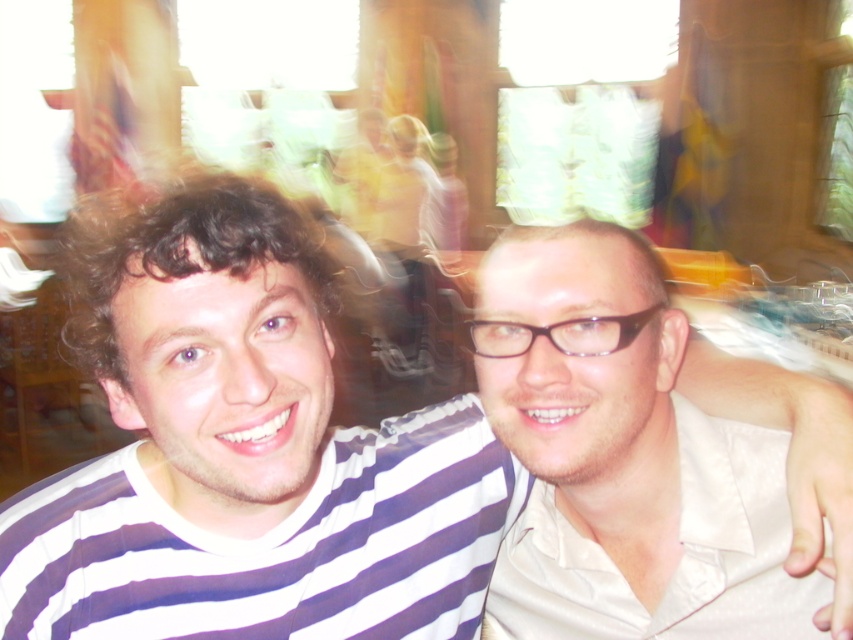
Does white striped shirt at center appear on the left side of matte white shirt at right?

Indeed, white striped shirt at center is positioned on the left side of matte white shirt at right.

Does white striped shirt at center have a smaller size compared to matte white shirt at right?

No, white striped shirt at center is not smaller than matte white shirt at right.

Is point (106, 301) closer to camera compared to point (616, 228)?

Yes, point (106, 301) is in front of point (616, 228).

Identify the location of white striped shirt at center. (242, 451).